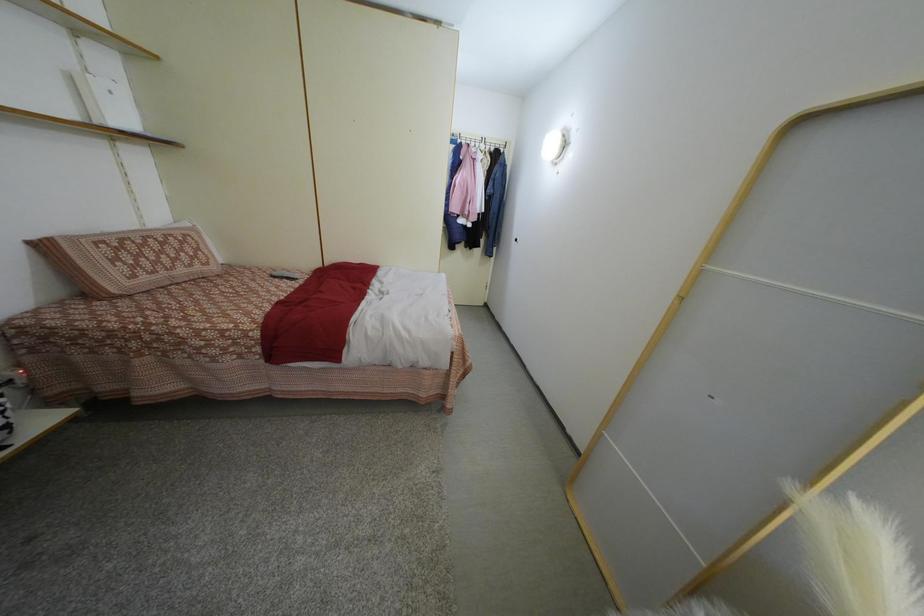
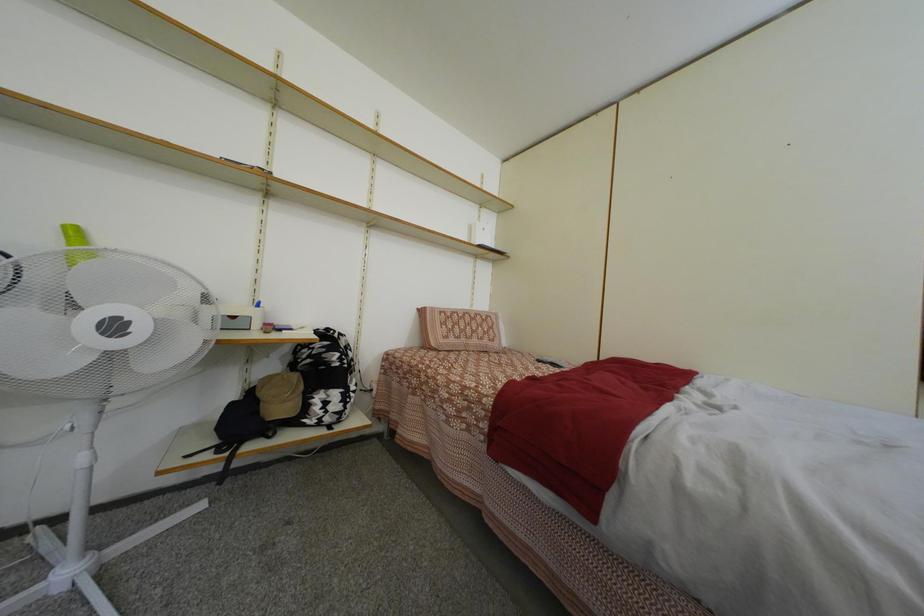
Consider the image. The first image is from the beginning of the video and the second image is from the end. How did the camera likely rotate when shooting the video?

The camera's rotation is toward left-up.